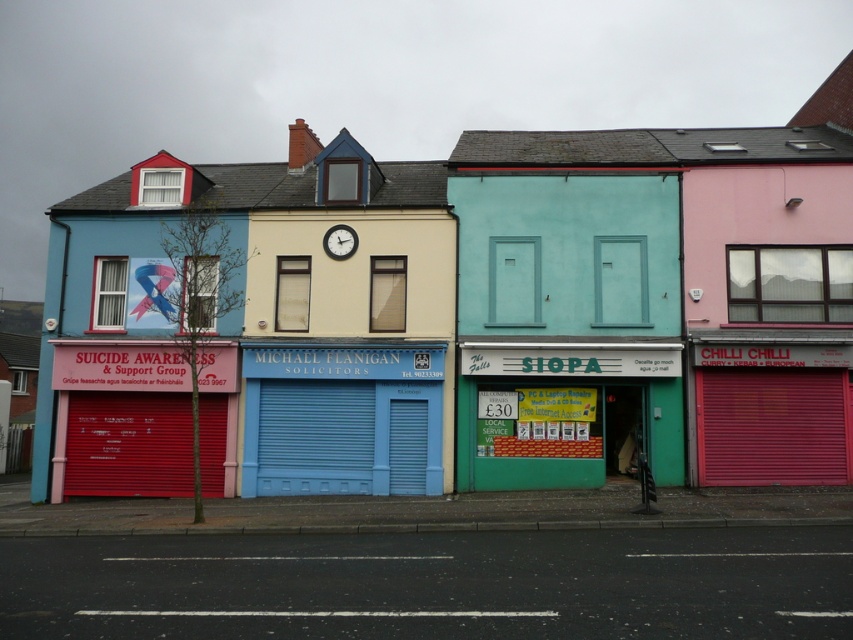
Question: Which object is farther from the camera taking this photo?

Choices:
 (A) matte plastic shutter at center
 (B) blue metallic garage door at center
 (C) blue matte storefront at center

Answer: (A)

Question: Considering the relative positions of blue metallic garage door at center and matte plastic shutter at center in the image provided, where is blue metallic garage door at center located with respect to matte plastic shutter at center?

Choices:
 (A) left
 (B) right

Answer: (B)

Question: Can you confirm if red matte door at left is wider than matte blue shutter at center?

Choices:
 (A) no
 (B) yes

Answer: (B)

Question: Can you confirm if matte blue shutter at center is positioned below matte black clock at center?

Choices:
 (A) no
 (B) yes

Answer: (B)

Question: Which object is the farthest from the blue metallic garage door at center?

Choices:
 (A) teal matte door at center
 (B) red matte garage door at lower left
 (C) matte red garage door at right

Answer: (C)

Question: Which object is positioned farthest from the matte black clock at center?

Choices:
 (A) blue painted shutter at center
 (B) teal matte door at center
 (C) green matte door at center

Answer: (C)